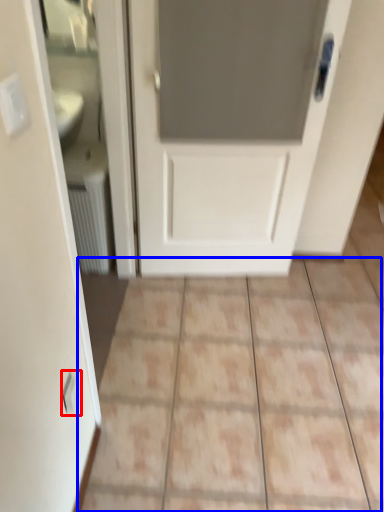
Question: Which point is further to the camera, electric outlet (highlighted by a red box) or ceramic tile (highlighted by a blue box)?

Choices:
 (A) electric outlet
 (B) ceramic tile

Answer: (B)